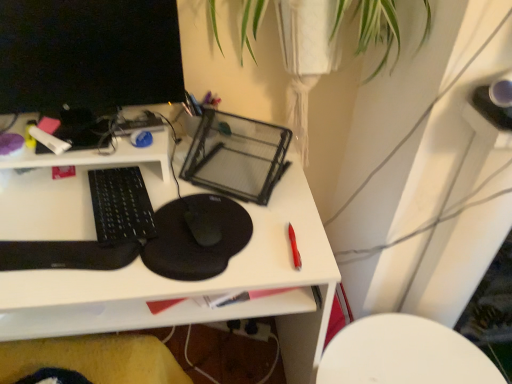
Measure the distance between black matte mousepad at center and camera.

black matte mousepad at center and camera are 76.23 centimeters apart.

What do you see at coordinates (294, 248) in the screenshot?
I see `red plastic pen at right, marked as the second stationery in a back-to-front arrangement` at bounding box center [294, 248].

This screenshot has height=384, width=512. What do you see at coordinates (49, 140) in the screenshot? I see `white matte marker at upper left, the first stationery in the back-to-front sequence` at bounding box center [49, 140].

Describe the element at coordinates (202, 225) in the screenshot. This screenshot has height=384, width=512. I see `black matte mouse at center` at that location.

Where is `black matte mousepad at center`? black matte mousepad at center is located at coordinates point(196,237).

From the image's perspective, does red plastic pen at right, marked as the second stationery in a back-to-front arrangement, appear higher than white matte marker at upper left, the second stationery from the front?

Actually, red plastic pen at right, marked as the second stationery in a back-to-front arrangement, appears below white matte marker at upper left, the second stationery from the front, in the image.

Considering the positions of points (294, 233) and (54, 150), is point (294, 233) closer to camera compared to point (54, 150)?

Yes, point (294, 233) is closer to viewer.

From a real-world perspective, which is physically above, red plastic pen at right, the 2th stationery viewed from the left, or white matte marker at upper left, the 1th stationery viewed from the top?

In real-world perspective, white matte marker at upper left, the 1th stationery viewed from the top, is above.

Is there a large distance between black matte mousepad at center and black matte mousepad at center?

No, black matte mousepad at center is in close proximity to black matte mousepad at center.

Is the depth of black matte mousepad at center less than that of black matte mousepad at center?

Yes, the depth of black matte mousepad at center is less than that of black matte mousepad at center.

Considering the sizes of objects black matte mousepad at center and black matte mousepad at center in the image provided, who is wider, black matte mousepad at center or black matte mousepad at center?

black matte mousepad at center is wider.

Is black matte mousepad at center not near white matte marker at upper left, the first stationery in the back-to-front sequence?

No.

I want to click on mousepad in front of the white matte marker at upper left, the first stationery in the back-to-front sequence, so click(196, 237).

Between black matte mousepad at center and white matte marker at upper left, the second stationery from the front, which one has less height?

black matte mousepad at center.

Between white plastic chair at lower right and black matte mouse at center, which one is positioned in front?

Positioned in front is black matte mouse at center.

Considering the sizes of white plastic chair at lower right and black matte mouse at center in the image, is white plastic chair at lower right wider or thinner than black matte mouse at center?

In the image, white plastic chair at lower right appears to be wider than black matte mouse at center.

Can you tell me how much white plastic chair at lower right and black matte mouse at center differ in facing direction?

The angular difference between white plastic chair at lower right and black matte mouse at center is 22.4 degrees.

From the picture: From the image's perspective, is white plastic chair at lower right above or below black matte mouse at center?

white plastic chair at lower right is below black matte mouse at center.

Does black glossy computer monitor at upper left appear on the left side of black matte mouse at center?

Yes.

This screenshot has width=512, height=384. I want to click on mouse behind the black glossy computer monitor at upper left, so click(202, 225).

Considering the sizes of objects black glossy computer monitor at upper left and black matte mouse at center in the image provided, who is taller, black glossy computer monitor at upper left or black matte mouse at center?

Standing taller between the two is black glossy computer monitor at upper left.

Can you confirm if black glossy computer monitor at upper left is thinner than black matte mouse at center?

Result: Yes.

Would you say black matte mousepad at center is part of red plastic pen at right, arranged as the second stationery when viewed from the top,'s contents?

No, black matte mousepad at center is not surrounded by red plastic pen at right, arranged as the second stationery when viewed from the top.

From the image's perspective, does red plastic pen at right, the 2th stationery viewed from the left, appear lower than black matte mousepad at center?

Yes, from the image's perspective, red plastic pen at right, the 2th stationery viewed from the left, is below black matte mousepad at center.

Is red plastic pen at right, the 2th stationery viewed from the left, smaller than black matte mousepad at center?

Indeed, red plastic pen at right, the 2th stationery viewed from the left, has a smaller size compared to black matte mousepad at center.

This screenshot has height=384, width=512. In the image, there is a black matte mousepad at center. In order to click on stationery below it (from the image's perspective) in this screenshot , I will do `click(294, 248)`.

Considering the positions of point (39, 137) and point (417, 335), is point (39, 137) closer or farther from the camera than point (417, 335)?

Point (39, 137) is positioned closer to the camera compared to point (417, 335).

In the image, is white matte marker at upper left, the 1th stationery when ordered from left to right, positioned in front of or behind white plastic chair at lower right?

Clearly, white matte marker at upper left, the 1th stationery when ordered from left to right, is in front of white plastic chair at lower right.

Does white matte marker at upper left, the 1th stationery when ordered from left to right, have a lesser height compared to white plastic chair at lower right?

Yes, white matte marker at upper left, the 1th stationery when ordered from left to right, is shorter than white plastic chair at lower right.

Does white matte marker at upper left, the 1th stationery when ordered from left to right, have a lesser width compared to white plastic chair at lower right?

Yes, white matte marker at upper left, the 1th stationery when ordered from left to right, is thinner than white plastic chair at lower right.

Locate an element on the screen. The height and width of the screenshot is (384, 512). stationery below the white matte marker at upper left, the second stationery ordered from the bottom (from a real-world perspective) is located at coordinates 294,248.

Identify the location of mousepad behind the black matte mousepad at center. (196, 237).

Based on their spatial positions, is black matte mouse at center or black matte mousepad at center closer to red plastic pen at right, arranged as the second stationery when viewed from the top?

black matte mouse at center.

From the picture: Which object lies further to the anchor point black matte mouse at center, white plastic chair at lower right or white matte marker at upper left, the second stationery ordered from the bottom?

The object further to black matte mouse at center is white plastic chair at lower right.

When comparing their distances from black glossy computer monitor at upper left, does black matte mouse at center or red plastic pen at right, which appears as the 1th stationery when ordered from the bottom, seem further?

Based on the image, red plastic pen at right, which appears as the 1th stationery when ordered from the bottom, appears to be further to black glossy computer monitor at upper left.

Which object lies nearer to the anchor point black matte mouse at center, red plastic pen at right, the 2th stationery viewed from the left, or black matte mousepad at center?

Among the two, black matte mousepad at center is located nearer to black matte mouse at center.

When comparing their distances from black matte mousepad at center, does black glossy computer monitor at upper left or white matte marker at upper left, the first stationery in the back-to-front sequence, seem further?

black glossy computer monitor at upper left.

Looking at the image, which one is located further to red plastic pen at right, which is the first stationery from front to back, white plastic chair at lower right or white matte marker at upper left, the second stationery ordered from the bottom?

white matte marker at upper left, the second stationery ordered from the bottom, is positioned further to the anchor red plastic pen at right, which is the first stationery from front to back.

From the image, which object appears to be nearer to white matte marker at upper left, the second stationery from the front, white plastic chair at lower right or red plastic pen at right, the 2th stationery viewed from the left?

The object closer to white matte marker at upper left, the second stationery from the front, is red plastic pen at right, the 2th stationery viewed from the left.

Based on their spatial positions, is black matte mousepad at center or black matte mousepad at center further from black matte mouse at center?

black matte mousepad at center lies further to black matte mouse at center than the other object.

I want to click on mousepad between black matte mousepad at center and white plastic chair at lower right in the horizontal direction, so click(x=196, y=237).

Locate an element on the screen. The image size is (512, 384). computer monitor between white matte marker at upper left, the 1th stationery viewed from the top, and black matte mousepad at center is located at coordinates (88, 54).

The image size is (512, 384). Find the location of `mousepad between white matte marker at upper left, the first stationery in the back-to-front sequence, and black matte mousepad at center in the up-down direction`. mousepad between white matte marker at upper left, the first stationery in the back-to-front sequence, and black matte mousepad at center in the up-down direction is located at coordinates (196, 237).

This screenshot has width=512, height=384. I want to click on mouse between black matte mousepad at center and red plastic pen at right, which is the first stationery from front to back, in the horizontal direction, so click(202, 225).